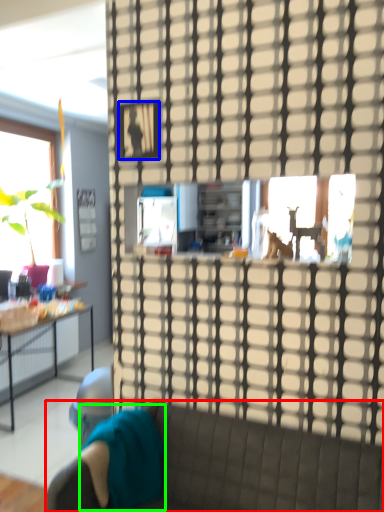
Question: Considering the real-world distances, which object is farthest from studio couch (highlighted by a red box)? picture frame (highlighted by a blue box) or pillow (highlighted by a green box)?

Choices:
 (A) picture frame
 (B) pillow

Answer: (A)